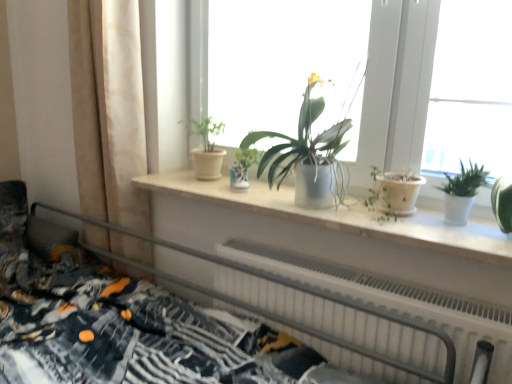
What do you see at coordinates (119, 321) in the screenshot? This screenshot has width=512, height=384. I see `patterned fabric bed at lower left` at bounding box center [119, 321].

What do you see at coordinates (397, 86) in the screenshot? I see `matte white windowsill at center` at bounding box center [397, 86].

What is the approximate width of white glossy pot at right, which is the 3th houseplant in left-to-right order?

It is 3.51 inches.

In order to face white glossy pot at right, which is the 3th houseplant in left-to-right order, should I rotate leftwards or rightwards?

You should rotate right by 25.406 degrees.

Identify the location of matte white pot at center, marked as the 3th houseplant in a right-to-left arrangement. (207, 148).

What do you see at coordinates (396, 302) in the screenshot? The width and height of the screenshot is (512, 384). I see `white plastic radiator at lower center` at bounding box center [396, 302].

What do you see at coordinates (342, 217) in the screenshot? I see `white matte window sill at center` at bounding box center [342, 217].

Where is `patterned fabric bed at lower left`? patterned fabric bed at lower left is located at coordinates coord(119,321).

Considering the relative positions of matte white windowsill at center and matte silver pot at center, the second houseplant viewed from the left, in the image provided, is matte white windowsill at center to the left or to the right of matte silver pot at center, the second houseplant viewed from the left,?

Based on their positions, matte white windowsill at center is located to the right of matte silver pot at center, the second houseplant viewed from the left.

Which point is more distant from viewer, (376, 85) or (331, 190)?

Positioned behind is point (376, 85).

Which object is further away from the camera taking this photo, matte white windowsill at center or matte silver pot at center, the second houseplant viewed from the left?

matte silver pot at center, the second houseplant viewed from the left, is further from the camera.

Is matte white windowsill at center bigger than matte silver pot at center, which is the second houseplant in right-to-left order?

Yes.

Based on the photo, does beige fabric curtain at left appear on the left side of white matte window sill at center?

Indeed, beige fabric curtain at left is positioned on the left side of white matte window sill at center.

The width and height of the screenshot is (512, 384). In order to click on curtain above the white matte window sill at center (from the image's perspective) in this screenshot , I will do `click(108, 110)`.

Measure the distance between beige fabric curtain at left and white matte window sill at center.

beige fabric curtain at left is 18.61 inches away from white matte window sill at center.

In terms of size, does beige fabric curtain at left appear bigger or smaller than white matte window sill at center?

Considering their sizes, beige fabric curtain at left takes up more space than white matte window sill at center.

Is beige fabric curtain at left positioned in front of white glossy pot at right, which is the 1th houseplant in right-to-left order?

That is False.

From a real-world perspective, is beige fabric curtain at left above or below white glossy pot at right, which is the 3th houseplant in left-to-right order?

Clearly, from a real-world perspective, beige fabric curtain at left is below white glossy pot at right, which is the 3th houseplant in left-to-right order.

Does point (146, 159) come closer to viewer compared to point (464, 213)?

No.

Considering the sizes of objects beige fabric curtain at left and white glossy pot at right, which is the 1th houseplant in right-to-left order, in the image provided, who is bigger, beige fabric curtain at left or white glossy pot at right, which is the 1th houseplant in right-to-left order,?

beige fabric curtain at left is bigger.

From the image's perspective, is matte white windowsill at center located above or below patterned fabric bed at lower left?

From the image's perspective, matte white windowsill at center appears above patterned fabric bed at lower left.

Between point (361, 151) and point (95, 372), which one is positioned behind?

The point (361, 151) is more distant.

Is matte white windowsill at center completely or partially outside of patterned fabric bed at lower left?

Absolutely, matte white windowsill at center is external to patterned fabric bed at lower left.

Is matte white windowsill at center positioned with its back to patterned fabric bed at lower left?

No, patterned fabric bed at lower left is not at the back of matte white windowsill at center.

Is white matte window sill at center positioned in front of white plastic radiator at lower center?

No, white matte window sill at center is further to the viewer.

Identify the location of window sill on the left of white plastic radiator at lower center. (342, 217).

Consider the image. Does white matte window sill at center have a lesser height compared to white plastic radiator at lower center?

Yes, white matte window sill at center is shorter than white plastic radiator at lower center.

Considering the relative sizes of white matte window sill at center and white plastic radiator at lower center in the image provided, is white matte window sill at center bigger than white plastic radiator at lower center?

Actually, white matte window sill at center might be smaller than white plastic radiator at lower center.

From the picture: Is matte white windowsill at center oriented away from white glossy pot at right, which is the 3th houseplant in left-to-right order?

Yes, white glossy pot at right, which is the 3th houseplant in left-to-right order, is at the back of matte white windowsill at center.

Is matte white windowsill at center next to white glossy pot at right, which is the 3th houseplant in left-to-right order?

No, matte white windowsill at center is not touching white glossy pot at right, which is the 3th houseplant in left-to-right order.

Between matte white windowsill at center and white glossy pot at right, which is the 1th houseplant in right-to-left order, which one has larger width?

With larger width is matte white windowsill at center.

Measure the distance between matte white windowsill at center and white glossy pot at right, which is the 3th houseplant in left-to-right order.

matte white windowsill at center is 7.96 inches away from white glossy pot at right, which is the 3th houseplant in left-to-right order.

Considering the sizes of objects beige fabric curtain at left and matte white windowsill at center in the image provided, who is taller, beige fabric curtain at left or matte white windowsill at center?

beige fabric curtain at left.

Is point (110, 199) positioned behind point (423, 134)?

Yes.

Can you see beige fabric curtain at left touching matte white windowsill at center?

No, beige fabric curtain at left is not beside matte white windowsill at center.

Can you confirm if beige fabric curtain at left is positioned to the right of matte white windowsill at center?

In fact, beige fabric curtain at left is to the left of matte white windowsill at center.

This screenshot has height=384, width=512. In order to click on window above the matte silver pot at center, which is the second houseplant in right-to-left order (from the image's perspective) in this screenshot , I will do click(397, 86).

There is a white matte window sill at center. Identify the location of curtain above it (from a real-world perspective). (108, 110).

From the image, which object appears to be farther from matte silver pot at center, the second houseplant viewed from the left, white glossy pot at right, which is the 3th houseplant in left-to-right order, or matte white pot at center, the 1th houseplant from the left?

white glossy pot at right, which is the 3th houseplant in left-to-right order, lies further to matte silver pot at center, the second houseplant viewed from the left, than the other object.

Estimate the real-world distances between objects in this image. Which object is further from white matte window sill at center, white glossy pot at right, which is the 3th houseplant in left-to-right order, or beige fabric curtain at left?

beige fabric curtain at left.

Based on their spatial positions, is beige fabric curtain at left or white glossy pot at right, which is the 3th houseplant in left-to-right order, further from white plastic radiator at lower center?

beige fabric curtain at left is positioned further to the anchor white plastic radiator at lower center.

From the image, which object appears to be nearer to white matte window sill at center, beige fabric curtain at left or white plastic radiator at lower center?

white plastic radiator at lower center lies closer to white matte window sill at center than the other object.

Based on their spatial positions, is white plastic radiator at lower center or white glossy pot at right, which is the 3th houseplant in left-to-right order, further from patterned fabric bed at lower left?

white glossy pot at right, which is the 3th houseplant in left-to-right order, is further to patterned fabric bed at lower left.

Considering their positions, is patterned fabric bed at lower left positioned closer to matte white pot at center, the 1th houseplant from the left, than white plastic radiator at lower center?

The object closer to matte white pot at center, the 1th houseplant from the left, is white plastic radiator at lower center.

Which object lies nearer to the anchor point matte white windowsill at center, white matte window sill at center or patterned fabric bed at lower left?

Among the two, white matte window sill at center is located nearer to matte white windowsill at center.

Based on their spatial positions, is matte white windowsill at center or white matte window sill at center further from patterned fabric bed at lower left?

The object further to patterned fabric bed at lower left is matte white windowsill at center.

Identify the location of radiator located between patterned fabric bed at lower left and beige fabric curtain at left in the depth direction. This screenshot has height=384, width=512. (396, 302).

At what (x,y) coordinates should I click in order to perform the action: click on curtain located between patterned fabric bed at lower left and matte white pot at center, the 1th houseplant from the left, in the depth direction. Please return your answer as a coordinate pair (x, y). The width and height of the screenshot is (512, 384). Looking at the image, I should click on (108, 110).

Where is `window located between patterned fabric bed at lower left and matte white pot at center, the 1th houseplant from the left, in the depth direction`? The height and width of the screenshot is (384, 512). window located between patterned fabric bed at lower left and matte white pot at center, the 1th houseplant from the left, in the depth direction is located at coordinates (397, 86).

Identify the location of window sill between beige fabric curtain at left and white glossy pot at right, which is the 3th houseplant in left-to-right order. (342, 217).